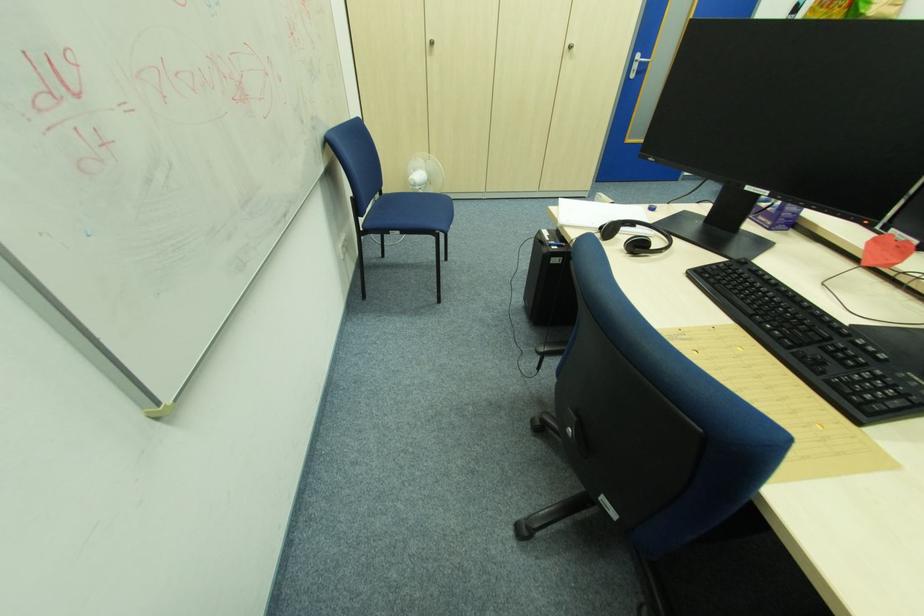
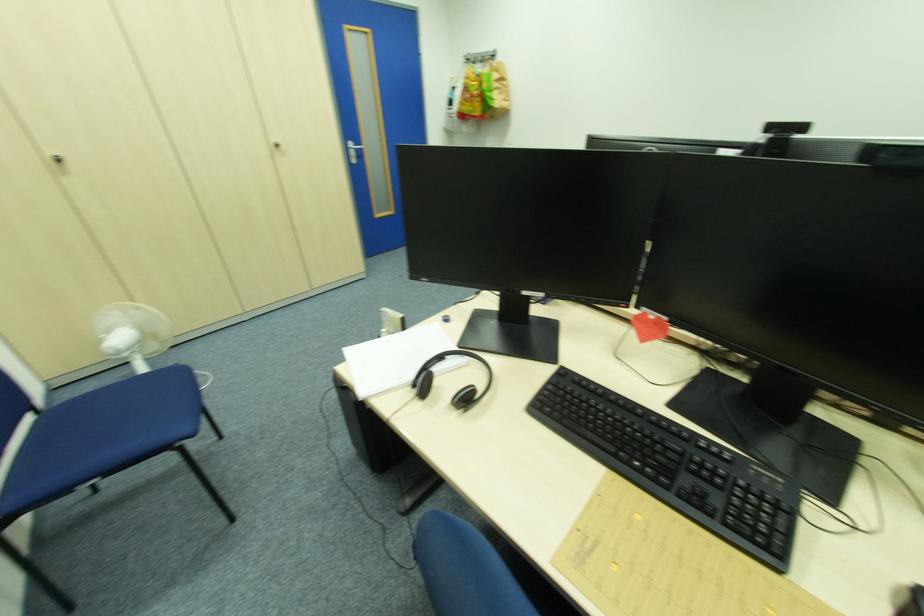
In the second image, find the point that corresponds to pixel 383 197 in the first image.

(38, 421)